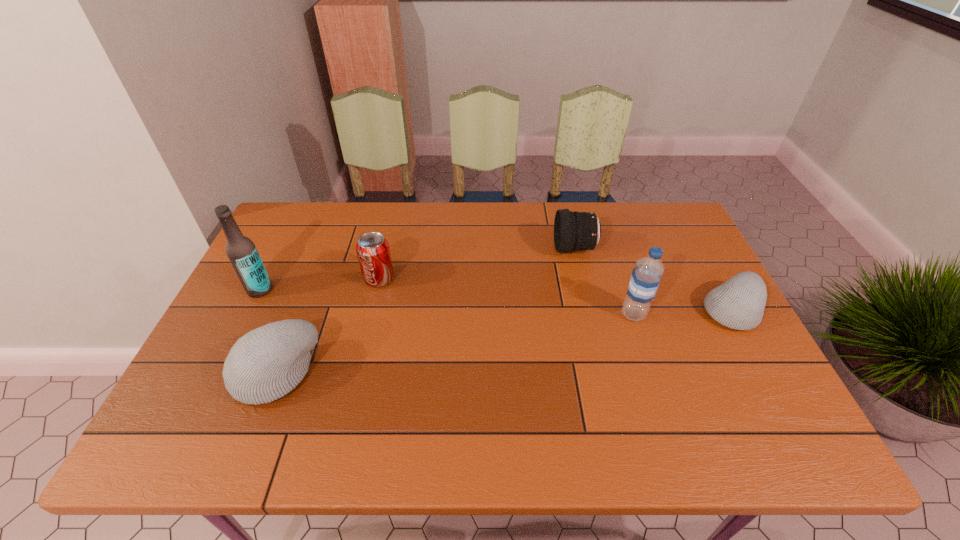
Identify the location of object that is the fourth closest to the farther beanie. The height and width of the screenshot is (540, 960). (265, 364).

Identify which object is the fifth nearest to the rightmost object. Please provide its 2D coordinates. Your answer should be formatted as a tuple, i.e. [(x, y)], where the tuple contains the x and y coordinates of a point satisfying the conditions above.

[(241, 251)]

The image size is (960, 540). Identify the location of blank space that satisfies the following two spatial constraints: 1. on the back side of the shortest object; 2. at the front element of the telephoto lens. (697, 248).

Locate an element on the screen. This screenshot has height=540, width=960. free space that satisfies the following two spatial constraints: 1. on the back side of the shorter beanie; 2. on the left side of the nearest object is located at coordinates (300, 310).

The height and width of the screenshot is (540, 960). I want to click on vacant space that satisfies the following two spatial constraints: 1. at the front element of the telephoto lens; 2. on the left side of the rightmost object, so click(x=589, y=310).

Locate an element on the screen. free space that satisfies the following two spatial constraints: 1. on the side of the taller beanie with the label; 2. on the right side of the tallest object is located at coordinates (218, 373).